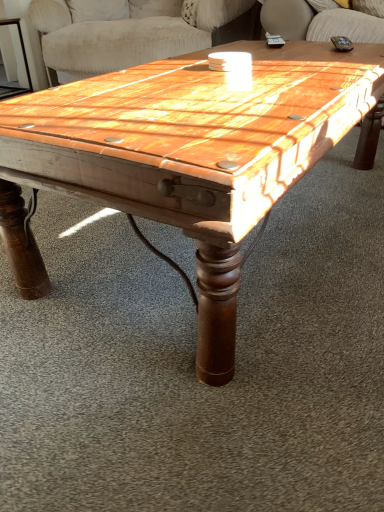
The height and width of the screenshot is (512, 384). Find the location of `wooden coffee table at center`. wooden coffee table at center is located at coordinates (185, 156).

In order to click on wooden side table at left in this screenshot , I will do `click(24, 63)`.

Is wooden coffee table at center wider or thinner than wooden swivel chair at upper center?

In the image, wooden coffee table at center appears to be more narrow than wooden swivel chair at upper center.

Is wooden coffee table at center aimed at wooden swivel chair at upper center?

No, wooden coffee table at center is not turned towards wooden swivel chair at upper center.

From the image's perspective, relative to wooden swivel chair at upper center, is wooden coffee table at center above or below?

wooden coffee table at center is below wooden swivel chair at upper center.

Which object is further away from the camera, wooden coffee table at center or wooden swivel chair at upper center?

wooden swivel chair at upper center is more distant.

From their relative heights in the image, would you say wooden side table at left is taller or shorter than wooden coffee table at center?

Considering their sizes, wooden side table at left has more height than wooden coffee table at center.

Does wooden side table at left have a lesser width compared to wooden coffee table at center?

Yes.

Measure the distance from wooden side table at left to wooden coffee table at center.

wooden side table at left and wooden coffee table at center are 7.95 feet apart.

From a real-world perspective, is wooden side table at left above or below wooden coffee table at center?

In terms of real-world spatial position, wooden side table at left is above wooden coffee table at center.

Is wooden coffee table at center behind wooden side table at left?

That is False.

From a real-world perspective, is wooden coffee table at center above or below wooden side table at left?

wooden coffee table at center is situated lower than wooden side table at left in the real world.

Looking at this image, can you confirm if wooden coffee table at center is thinner than wooden side table at left?

In fact, wooden coffee table at center might be wider than wooden side table at left.

Is wooden swivel chair at upper center facing towards wooden coffee table at center?

Yes, wooden swivel chair at upper center is turned towards wooden coffee table at center.

Based on their sizes in the image, would you say wooden swivel chair at upper center is bigger or smaller than wooden coffee table at center?

wooden swivel chair at upper center is bigger than wooden coffee table at center.

From the image's perspective, between wooden swivel chair at upper center and wooden coffee table at center, who is located below?

wooden coffee table at center is shown below in the image.

Identify the location of coffee table below the wooden swivel chair at upper center (from the image's perspective). (185, 156).

In terms of size, does wooden swivel chair at upper center appear bigger or smaller than wooden side table at left?

Considering their sizes, wooden swivel chair at upper center takes up more space than wooden side table at left.

Is wooden swivel chair at upper center facing towards wooden side table at left?

No.

Is wooden swivel chair at upper center to the right of wooden side table at left from the viewer's perspective?

Correct, you'll find wooden swivel chair at upper center to the right of wooden side table at left.

In the scene shown: From the image's perspective, which one is positioned higher, wooden swivel chair at upper center or wooden side table at left?

From the image's view, wooden swivel chair at upper center is above.

Considering the relative positions of wooden side table at left and wooden swivel chair at upper center in the image provided, is wooden side table at left to the right of wooden swivel chair at upper center from the viewer's perspective?

No.

Can you confirm if wooden side table at left is bigger than wooden swivel chair at upper center?

Incorrect, wooden side table at left is not larger than wooden swivel chair at upper center.

Is wooden side table at left surrounding wooden swivel chair at upper center?

No, wooden swivel chair at upper center is not a part of wooden side table at left.

Looking at this image, considering the sizes of wooden side table at left and wooden swivel chair at upper center in the image, is wooden side table at left wider or thinner than wooden swivel chair at upper center?

wooden side table at left is thinner than wooden swivel chair at upper center.

The image size is (384, 512). I want to click on swivel chair positioned vertically above the wooden coffee table at center (from a real-world perspective), so click(x=132, y=31).

Locate an element on the screen. This screenshot has width=384, height=512. side table located behind the wooden coffee table at center is located at coordinates (24, 63).

Which object lies nearer to the anchor point wooden coffee table at center, wooden side table at left or wooden swivel chair at upper center?

wooden swivel chair at upper center lies closer to wooden coffee table at center than the other object.

Based on their spatial positions, is wooden coffee table at center or wooden side table at left closer to wooden swivel chair at upper center?

Among the two, wooden side table at left is located nearer to wooden swivel chair at upper center.

Based on their spatial positions, is wooden swivel chair at upper center or wooden side table at left further from wooden coffee table at center?

wooden side table at left.

Estimate the real-world distances between objects in this image. Which object is further from wooden side table at left, wooden swivel chair at upper center or wooden coffee table at center?

wooden coffee table at center is further to wooden side table at left.

Estimate the real-world distances between objects in this image. Which object is further from wooden swivel chair at upper center, wooden side table at left or wooden coffee table at center?

The object further to wooden swivel chair at upper center is wooden coffee table at center.

When comparing their distances from wooden side table at left, does wooden coffee table at center or wooden swivel chair at upper center seem further?

The object further to wooden side table at left is wooden coffee table at center.

Find the location of `swivel chair between wooden coffee table at center and wooden side table at left in the front-back direction`. swivel chair between wooden coffee table at center and wooden side table at left in the front-back direction is located at coordinates (132, 31).